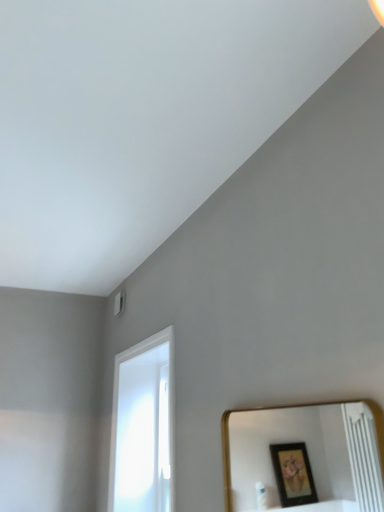
Question: In terms of height, does gold-framed mirror at lower right look taller or shorter compared to white glossy door at lower left?

Choices:
 (A) tall
 (B) short

Answer: (B)

Question: Considering the positions of gold-framed mirror at lower right and white glossy door at lower left in the image, is gold-framed mirror at lower right wider or thinner than white glossy door at lower left?

Choices:
 (A) wide
 (B) thin

Answer: (B)

Question: From the image's perspective, is gold-framed mirror at lower right above or below white glossy door at lower left?

Choices:
 (A) below
 (B) above

Answer: (B)

Question: Visually, is white glossy door at lower left positioned to the left or to the right of gold-framed mirror at lower right?

Choices:
 (A) right
 (B) left

Answer: (B)

Question: From the image's perspective, is white glossy door at lower left above or below gold-framed mirror at lower right?

Choices:
 (A) below
 (B) above

Answer: (A)

Question: From their relative heights in the image, would you say white glossy door at lower left is taller or shorter than gold-framed mirror at lower right?

Choices:
 (A) tall
 (B) short

Answer: (A)

Question: From a real-world perspective, relative to gold-framed mirror at lower right, is white glossy door at lower left vertically above or below?

Choices:
 (A) below
 (B) above

Answer: (B)